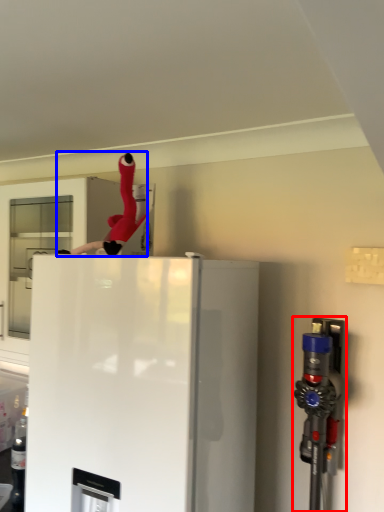
Question: Which point is further to the camera, appliance (highlighted by a red box) or person (highlighted by a blue box)?

Choices:
 (A) appliance
 (B) person

Answer: (B)